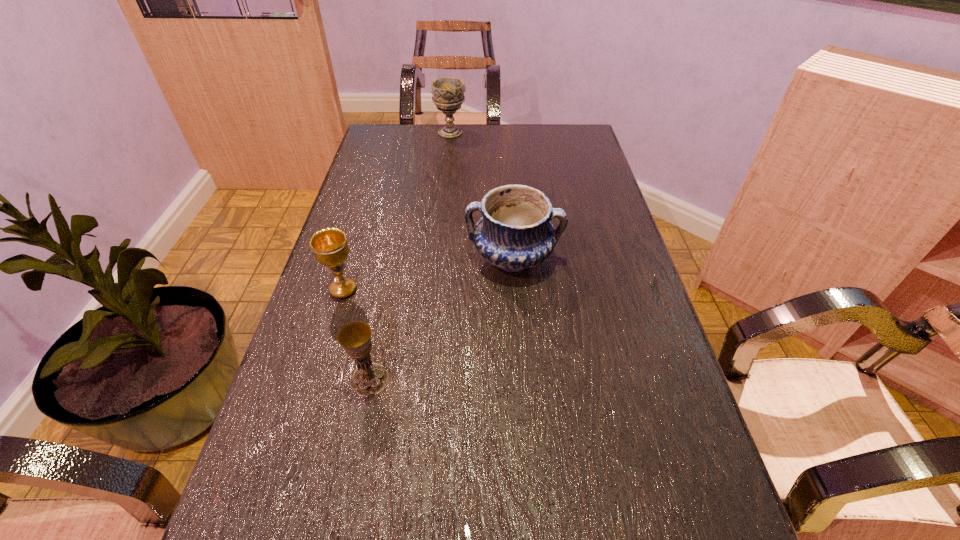
The image size is (960, 540). I want to click on unoccupied position between the farthest chalice and the leftmost object, so click(x=396, y=211).

The height and width of the screenshot is (540, 960). What are the coordinates of `free space between the pottery and the third object from left to right` in the screenshot? It's located at 482,195.

Locate an element on the screen. Image resolution: width=960 pixels, height=540 pixels. free area in between the pottery and the farthest chalice is located at coordinates [x=482, y=195].

Identify the location of unoccupied area between the farthest object and the leftmost chalice. (396, 211).

Locate which object is the closest to the farthest object. Please provide its 2D coordinates. Your answer should be formatted as a tuple, i.e. [(x, y)], where the tuple contains the x and y coordinates of a point satisfying the conditions above.

[(515, 233)]

Identify which object is the second nearest to the third object from right to left. Please provide its 2D coordinates. Your answer should be formatted as a tuple, i.e. [(x, y)], where the tuple contains the x and y coordinates of a point satisfying the conditions above.

[(515, 233)]

Locate an element on the screen. This screenshot has height=540, width=960. chalice that is the closest one to the rightmost chalice is located at coordinates (330, 247).

The width and height of the screenshot is (960, 540). I want to click on chalice that can be found as the second closest to the nearest object, so click(x=448, y=92).

In order to click on vacant space that satisfies the following two spatial constraints: 1. on the back side of the nearest object; 2. on the left side of the pottery in this screenshot , I will do `click(394, 258)`.

This screenshot has height=540, width=960. I want to click on free space that satisfies the following two spatial constraints: 1. on the back side of the pottery; 2. on the left side of the nearest chalice, so click(x=394, y=258).